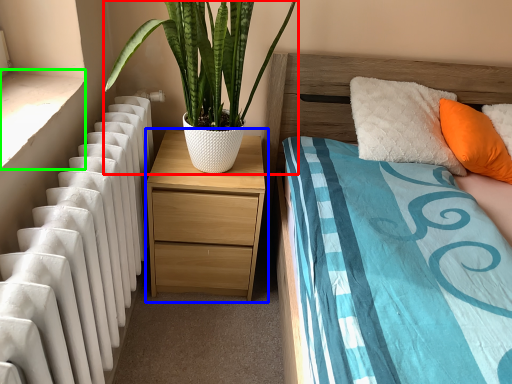
Question: Which object is positioned closest to houseplant (highlighted by a red box)? Select from nightstand (highlighted by a blue box) and window sill (highlighted by a green box).

Choices:
 (A) nightstand
 (B) window sill

Answer: (A)